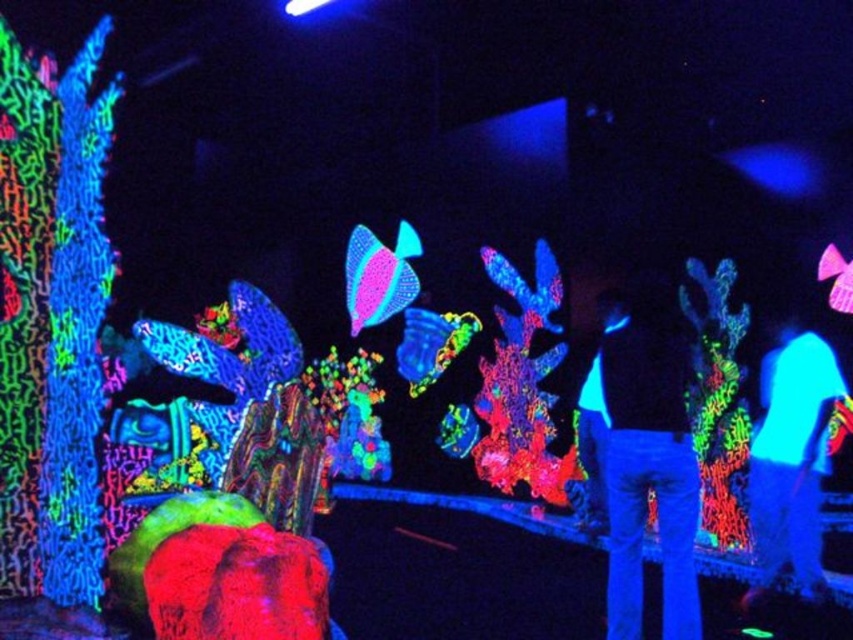
You are an art curator examining the installation. You notice the matte black jacket at center and the neon blue fabric at center. Which object is positioned higher in the scene?

The matte black jacket at center is above the neon blue fabric at center, so it is positioned higher in the scene.

You are an artist who wants to place a glowing coral sculpture between the matte black jacket at center and the neon blue fabric at center. Based on their positions, which object should the sculpture be closer to?

The sculpture should be placed closer to the neon blue fabric at center because the matte black jacket at center is to the left of the neon blue fabric at center, meaning the neon blue fabric is on the right side of the jacket. Therefore, placing the sculpture between them would require it to be closer to the right side where the neon blue fabric is located.

You are an artist standing in the middle of the blacklight room, surrounded by glowing coral sculptures. You notice two glowing points in the scene. The first point is at coordinate point (x=622, y=486) and the second is at coordinate point (x=808, y=412). Which of these two points is closer to you?

Point (x=622, y=486) is closer to you because it is in front of point (x=808, y=412).